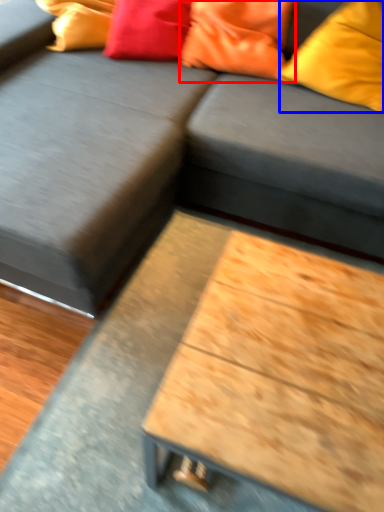
Question: Which object appears farthest to the camera in this image, pillow (highlighted by a red box) or pillow (highlighted by a blue box)?

Choices:
 (A) pillow
 (B) pillow

Answer: (A)